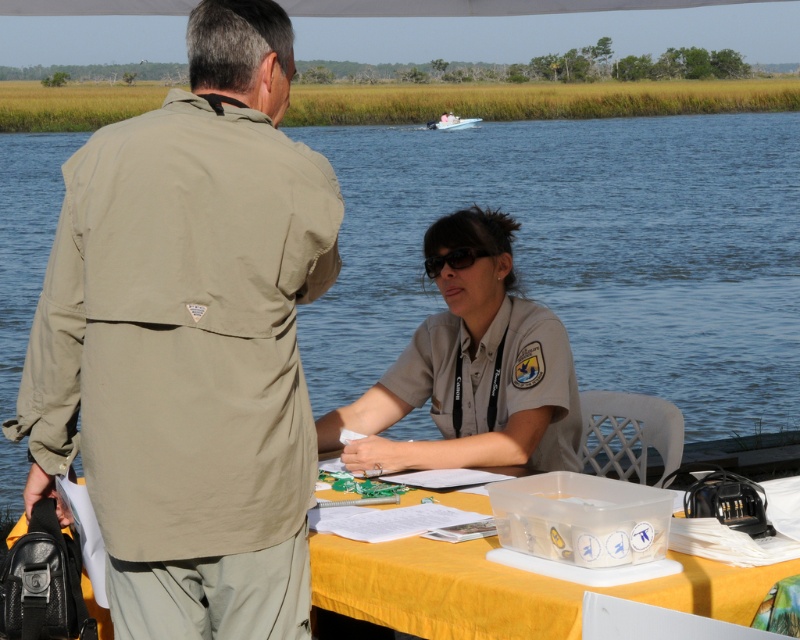
Question: Can you confirm if khaki fabric jacket at left is bigger than yellow fabric table at lower center?

Choices:
 (A) yes
 (B) no

Answer: (A)

Question: Does tan uniform at center appear on the right side of yellow fabric table at lower center?

Choices:
 (A) no
 (B) yes

Answer: (A)

Question: Can you confirm if blue water at center is positioned to the right of yellow fabric table at lower center?

Choices:
 (A) no
 (B) yes

Answer: (A)

Question: Which point is closer to the camera taking this photo?

Choices:
 (A) (492, 310)
 (B) (352, 314)
 (C) (742, 620)

Answer: (C)

Question: Which point appears farthest from the camera in this image?

Choices:
 (A) (68, 248)
 (B) (444, 264)
 (C) (422, 630)
 (D) (318, 336)

Answer: (D)

Question: Which object is positioned farthest from the blue water at center?

Choices:
 (A) white plastic boat at upper center
 (B) khaki fabric jacket at left

Answer: (B)